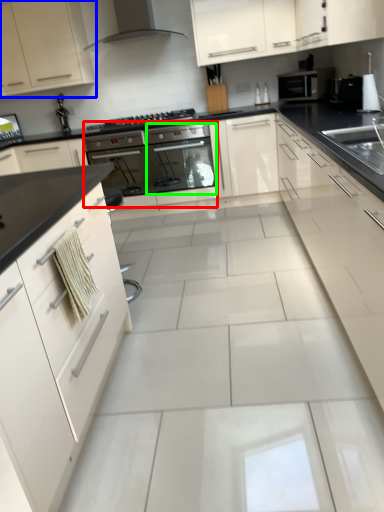
Question: Estimate the real-world distances between objects in this image. Which object is farther from oven (highlighted by a red box), cabinetry (highlighted by a blue box) or oven (highlighted by a green box)?

Choices:
 (A) cabinetry
 (B) oven

Answer: (A)